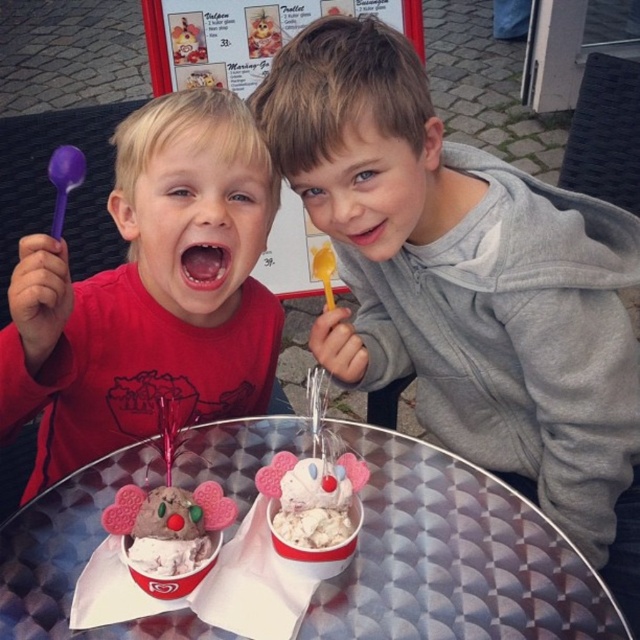
You are a photographer trying to capture a candid shot of the children. You notice the matte red shirt at left and the metallic silver table at center. Which object should you focus on first if you want to capture the child who is facing the camera?

The metallic silver table at center is to the right of the matte red shirt at left. Since the boy on the right in the gray hoodie is leaning towards the camera, focusing on the metallic silver table at center area would help capture him as he is positioned near it.

You are a photographer trying to capture a closeup of the metallic silver table at center. You notice the matte red shirt at left is partially blocking your view. Based on their sizes, which object should you move closer to the camera to frame the scene better?

The matte red shirt at left is bigger than the metallic silver table at center, so moving the matte red shirt at left closer to the camera would allow it to block less of the table in the frame, making the metallic silver table at center more visible.